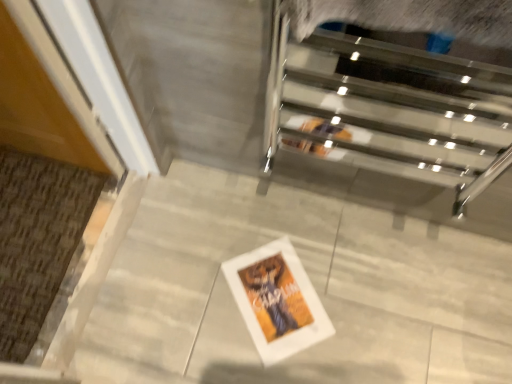
The image size is (512, 384). In order to click on free point behind white matte picture frame at center in this screenshot , I will do `click(271, 219)`.